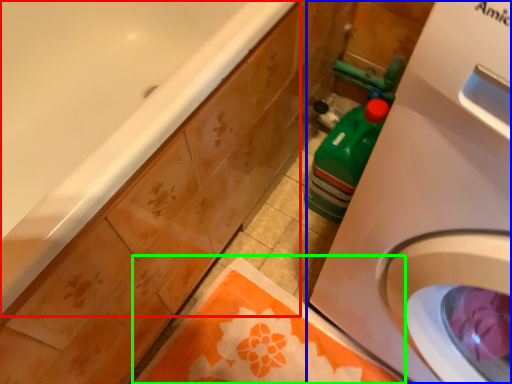
Question: Based on their relative distances, which object is farther from bathtub (highlighted by a red box)? Choose from washing machine (highlighted by a blue box) and beach towel (highlighted by a green box).

Choices:
 (A) washing machine
 (B) beach towel

Answer: (B)